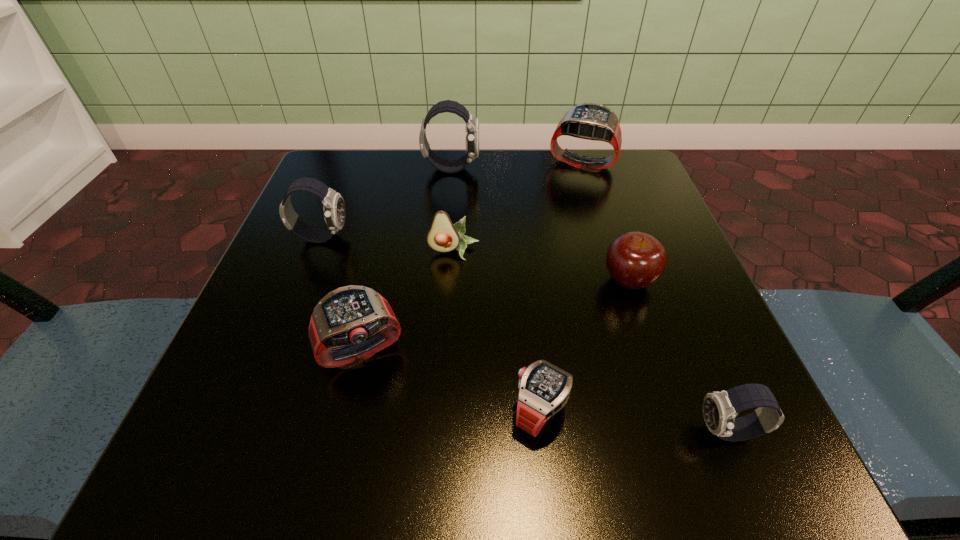
Image resolution: width=960 pixels, height=540 pixels. I want to click on avocado, so click(x=443, y=236).

What are the coordinates of `the smallest dark watch` in the screenshot? It's located at (719, 408).

Find the location of `the rightmost dark watch`. the rightmost dark watch is located at coordinates (719, 408).

You are a GUI agent. You are given a task and a screenshot of the screen. Output one action in this format:
    pyautogui.click(x=<x>, y=<y>)
    Task: Click on the shortest object
    
    Given the screenshot: What is the action you would take?
    pyautogui.click(x=544, y=389)

Locate an element on the screen. the shortest watch is located at coordinates (544, 389).

This screenshot has height=540, width=960. Find the location of `vacant space located 0.350m on the face of the tallest watch`. vacant space located 0.350m on the face of the tallest watch is located at coordinates (634, 168).

Locate an element on the screen. Image resolution: width=960 pixels, height=540 pixels. free space located on the front of the rightmost red watch is located at coordinates (605, 237).

Where is `blank space located on the face of the second nearest dark watch`? This screenshot has height=540, width=960. blank space located on the face of the second nearest dark watch is located at coordinates (487, 237).

Image resolution: width=960 pixels, height=540 pixels. What are the coordinates of `vacant space situated on the left of the fourth farthest watch` in the screenshot? It's located at (244, 352).

This screenshot has height=540, width=960. In order to click on vacant space located 0.050m on the right of the apple in this screenshot , I will do `click(685, 280)`.